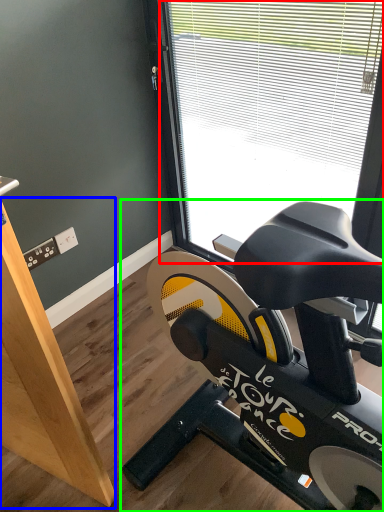
Question: Which is farther away from window (highlighted by a red box)? plywood (highlighted by a blue box) or stationary bicycle (highlighted by a green box)?

Choices:
 (A) plywood
 (B) stationary bicycle

Answer: (A)